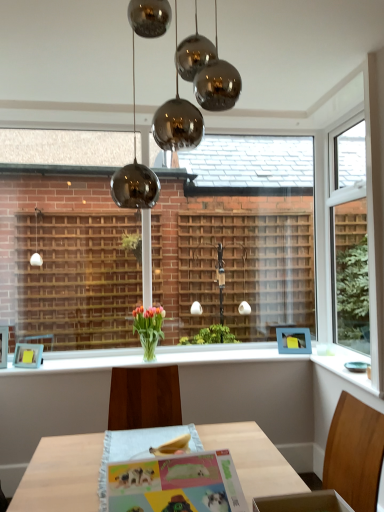
The height and width of the screenshot is (512, 384). Find the location of `free spot above white glossy window sill at center, placed as the 1th window sill when sorted from left to right (from a real-world perspective)`. free spot above white glossy window sill at center, placed as the 1th window sill when sorted from left to right (from a real-world perspective) is located at coordinates (178, 352).